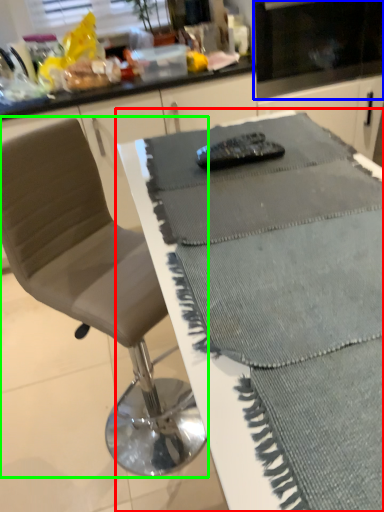
Question: Based on their relative distances, which object is nearer to table (highlighted by a red box)? Choose from appliance (highlighted by a blue box) and chair (highlighted by a green box).

Choices:
 (A) appliance
 (B) chair

Answer: (B)